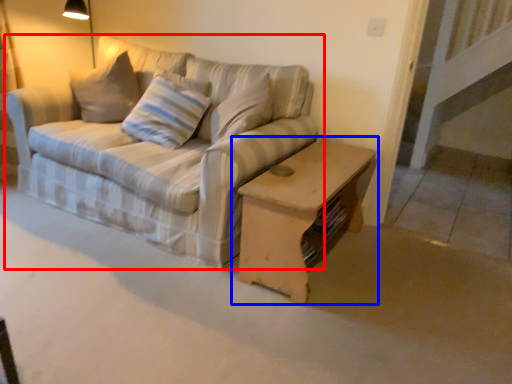
Question: Which object appears farthest to the camera in this image, studio couch (highlighted by a red box) or table (highlighted by a blue box)?

Choices:
 (A) studio couch
 (B) table

Answer: (B)